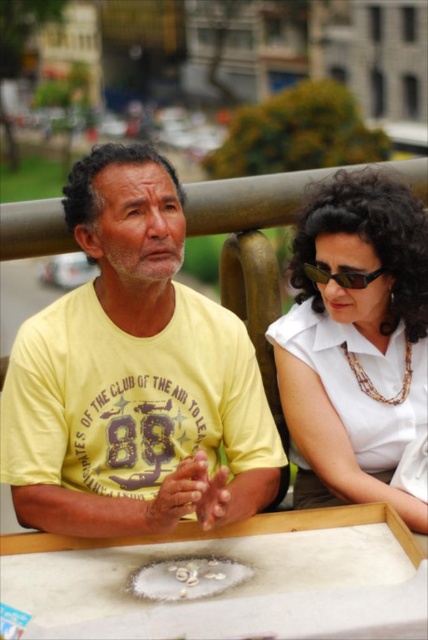
Question: Which object is farther from the camera taking this photo?

Choices:
 (A) black reflective sunglasses at upper right
 (B) yellow cotton shirt at center

Answer: (A)

Question: Does white glossy shirt at upper right appear on the right side of black reflective sunglasses at upper right?

Choices:
 (A) yes
 (B) no

Answer: (A)

Question: Which point is farther from the camera taking this photo?

Choices:
 (A) (71, 470)
 (B) (258, 536)

Answer: (A)

Question: Estimate the real-world distances between objects in this image. Which object is closer to the white glossy shirt at upper right?

Choices:
 (A) yellow cotton shirt at center
 (B) black reflective sunglasses at upper right
 (C) white matte table at center

Answer: (B)

Question: Is yellow cotton shirt at center thinner than white matte table at center?

Choices:
 (A) no
 (B) yes

Answer: (B)

Question: Can you confirm if yellow cotton shirt at center is bigger than white matte table at center?

Choices:
 (A) no
 (B) yes

Answer: (B)